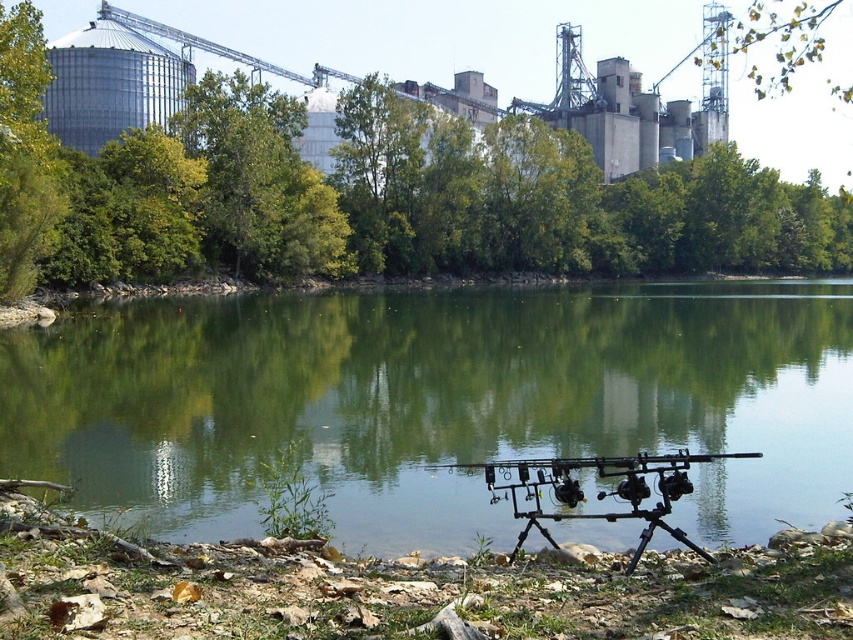
Which is in front, point (563, 464) or point (791, 54)?

Point (563, 464) is more forward.

The image size is (853, 640). Identify the location of black matte tripod at center. (601, 490).

Who is more forward, (314, 403) or (799, 17)?

Point (314, 403)

Where is `green smooth water at center`? green smooth water at center is located at coordinates 434,403.

Consider the image. Can you confirm if green smooth water at center is positioned above green leafy tree at center?

No.

Is green smooth water at center shorter than green leafy tree at center?

Yes.

Does point (825, 288) lie behind point (218, 164)?

Yes, it is behind point (218, 164).

Where is `green smooth water at center`? green smooth water at center is located at coordinates (434, 403).